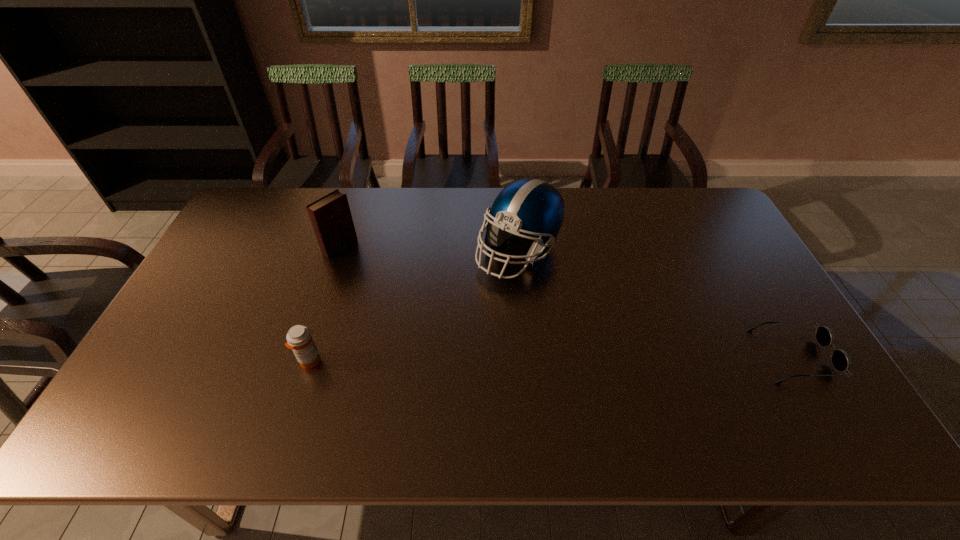
Identify the location of free space between the football helmet and the rightmost object. (657, 303).

This screenshot has width=960, height=540. I want to click on empty location between the diary and the tallest object, so click(x=429, y=249).

The width and height of the screenshot is (960, 540). I want to click on unoccupied area between the tallest object and the shortest object, so click(657, 303).

Where is `unoccupied position between the third tallest object and the shortest object`? The height and width of the screenshot is (540, 960). unoccupied position between the third tallest object and the shortest object is located at coordinates (552, 359).

This screenshot has width=960, height=540. What are the coordinates of `the closest object to the diary` in the screenshot? It's located at (299, 339).

Identify which object is the third closest to the medicine. Please provide its 2D coordinates. Your answer should be formatted as a tuple, i.e. [(x, y)], where the tuple contains the x and y coordinates of a point satisfying the conditions above.

[(840, 360)]

I want to click on vacant space that satisfies the following two spatial constraints: 1. on the front side of the third object from left to right; 2. on the front-facing side of the rightmost object, so click(528, 355).

Identify the location of blank space that satisfies the following two spatial constraints: 1. on the front side of the third tallest object; 2. on the right side of the diary. This screenshot has width=960, height=540. (302, 361).

Image resolution: width=960 pixels, height=540 pixels. Identify the location of free space that satisfies the following two spatial constraints: 1. on the front side of the football helmet; 2. on the front-facing side of the sunglasses. (528, 355).

What are the coordinates of `vacant space that satisfies the following two spatial constraints: 1. on the front side of the diary; 2. on the left side of the football helmet` in the screenshot? It's located at (338, 252).